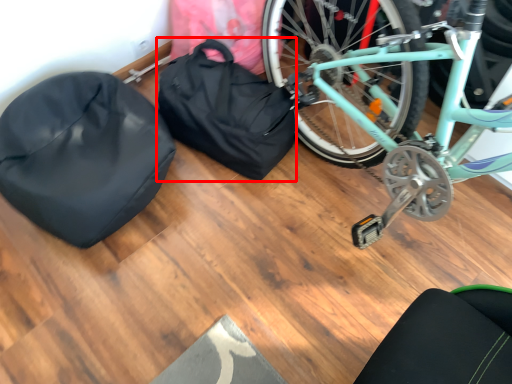
Question: From the image's perspective, considering the relative positions of bag (annotated by the red box) and sleeping bag in the image provided, where is bag (annotated by the red box) located with respect to the staircase?

Choices:
 (A) above
 (B) below

Answer: (A)